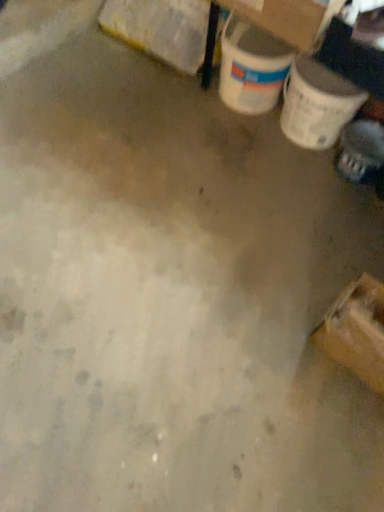
Question: Can you confirm if yellow cardboard box at upper left, which is the 2th cardboard box in front-to-back order, is smaller than shiny black shoe at lower right?

Choices:
 (A) no
 (B) yes

Answer: (A)

Question: Is yellow cardboard box at upper left, which is the 2th cardboard box in front-to-back order, touching shiny black shoe at lower right?

Choices:
 (A) no
 (B) yes

Answer: (A)

Question: Is yellow cardboard box at upper left, which is the first cardboard box in back-to-front order, completely or partially outside of shiny black shoe at lower right?

Choices:
 (A) yes
 (B) no

Answer: (A)

Question: From the image's perspective, is yellow cardboard box at upper left, the 2th cardboard box when ordered from right to left, under shiny black shoe at lower right?

Choices:
 (A) no
 (B) yes

Answer: (A)

Question: From a real-world perspective, is yellow cardboard box at upper left, the 2th cardboard box when ordered from right to left, physically above shiny black shoe at lower right?

Choices:
 (A) yes
 (B) no

Answer: (A)

Question: Visually, is shiny black shoe at lower right positioned to the left or to the right of cardboard box at upper right, which is counted as the first cardboard box, starting from the front?

Choices:
 (A) right
 (B) left

Answer: (A)

Question: Is point (375, 136) positioned closer to the camera than point (302, 13)?

Choices:
 (A) farther
 (B) closer

Answer: (A)

Question: Is shiny black shoe at lower right inside the boundaries of cardboard box at upper right, the first cardboard box viewed from the right, or outside?

Choices:
 (A) outside
 (B) inside

Answer: (A)

Question: From a real-world perspective, is shiny black shoe at lower right positioned above or below cardboard box at upper right, the 2th cardboard box from the left?

Choices:
 (A) below
 (B) above

Answer: (A)

Question: Considering the positions of shiny black shoe at lower right and yellow cardboard box at upper left, which is the first cardboard box in back-to-front order, in the image, is shiny black shoe at lower right taller or shorter than yellow cardboard box at upper left, which is the first cardboard box in back-to-front order,?

Choices:
 (A) tall
 (B) short

Answer: (B)

Question: From a real-world perspective, is shiny black shoe at lower right physically located above or below yellow cardboard box at upper left, which is the first cardboard box in back-to-front order?

Choices:
 (A) above
 (B) below

Answer: (B)

Question: Which is correct: shiny black shoe at lower right is inside yellow cardboard box at upper left, which is the 2th cardboard box in front-to-back order, or outside of it?

Choices:
 (A) outside
 (B) inside

Answer: (A)

Question: Considering the relative positions of shiny black shoe at lower right and yellow cardboard box at upper left, the 2th cardboard box when ordered from right to left, in the image provided, is shiny black shoe at lower right to the left or to the right of yellow cardboard box at upper left, the 2th cardboard box when ordered from right to left,?

Choices:
 (A) left
 (B) right

Answer: (B)

Question: Considering the positions of yellow cardboard box at upper left, which is the 2th cardboard box in front-to-back order, and shiny black shoe at lower right in the image, is yellow cardboard box at upper left, which is the 2th cardboard box in front-to-back order, bigger or smaller than shiny black shoe at lower right?

Choices:
 (A) small
 (B) big

Answer: (B)

Question: From a real-world perspective, is yellow cardboard box at upper left, which is the first cardboard box in back-to-front order, positioned above or below shiny black shoe at lower right?

Choices:
 (A) above
 (B) below

Answer: (A)